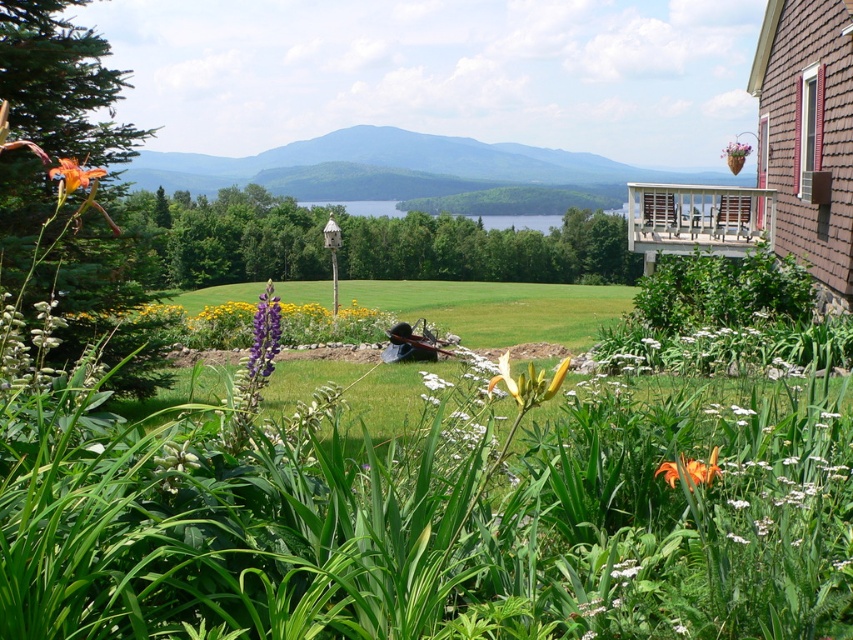
You are standing in the garden and want to take a photo of the orange matte flower at center. Based on its position, where should you aim your camera to capture it?

The orange matte flower at center is located at point coordinates of (689, 470), so you should aim your camera towards that coordinate to capture it.